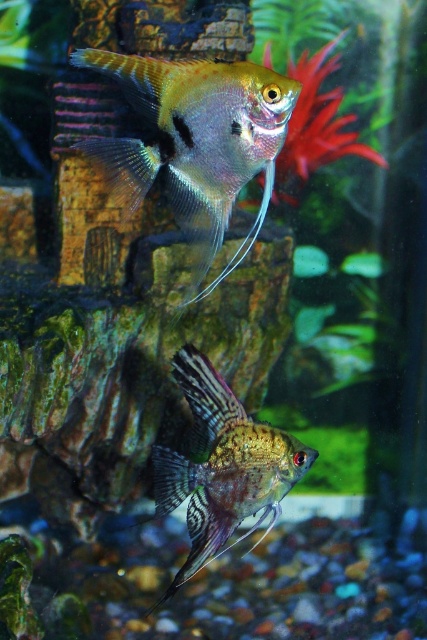
Does translucent iridescent fish at upper center have a larger size compared to shiny metallic fish at center?

Yes, translucent iridescent fish at upper center is bigger than shiny metallic fish at center.

Based on the photo, does translucent iridescent fish at upper center appear on the right side of shiny metallic fish at center?

Incorrect, translucent iridescent fish at upper center is not on the right side of shiny metallic fish at center.

Measure the distance between translucent iridescent fish at upper center and camera.

translucent iridescent fish at upper center is 35.97 inches from camera.

Identify the location of translucent iridescent fish at upper center. (195, 141).